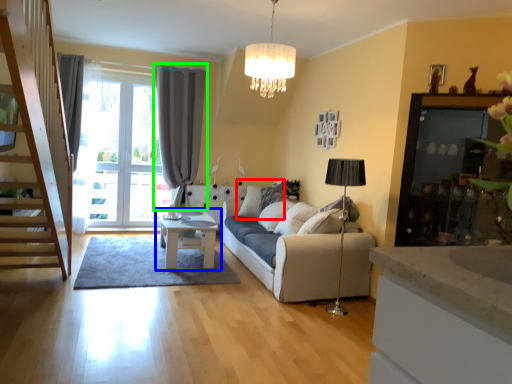
Question: Based on their relative distances, which object is farther from pillow (highlighted by a red box)? Choose from table (highlighted by a blue box) and curtain (highlighted by a green box).

Choices:
 (A) table
 (B) curtain

Answer: (B)